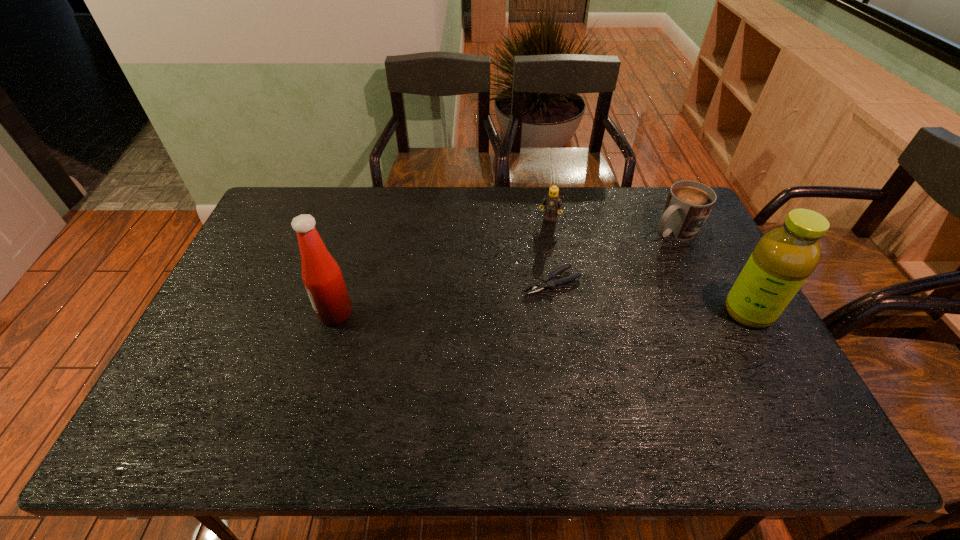
The width and height of the screenshot is (960, 540). I want to click on vacant spot on the desktop that is between the condiment and the fruit juice and is positioned on the side of the mug with the handle, so click(541, 313).

This screenshot has height=540, width=960. Identify the location of free space on the desktop that is between the condiment and the fruit juice and is positioned in front of the Lego. (506, 313).

The width and height of the screenshot is (960, 540). I want to click on free spot on the desktop that is between the condiment and the fruit juice and is positioned at the gripping part of the shortest object, so click(484, 313).